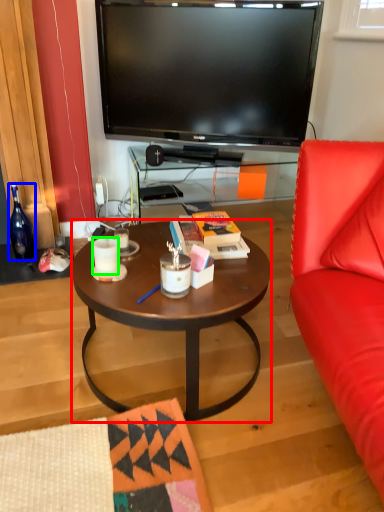
Question: Considering the real-world distances, which object is closest to coffee table (highlighted by a red box)? bottle (highlighted by a blue box) or coffee cup (highlighted by a green box).

Choices:
 (A) bottle
 (B) coffee cup

Answer: (B)